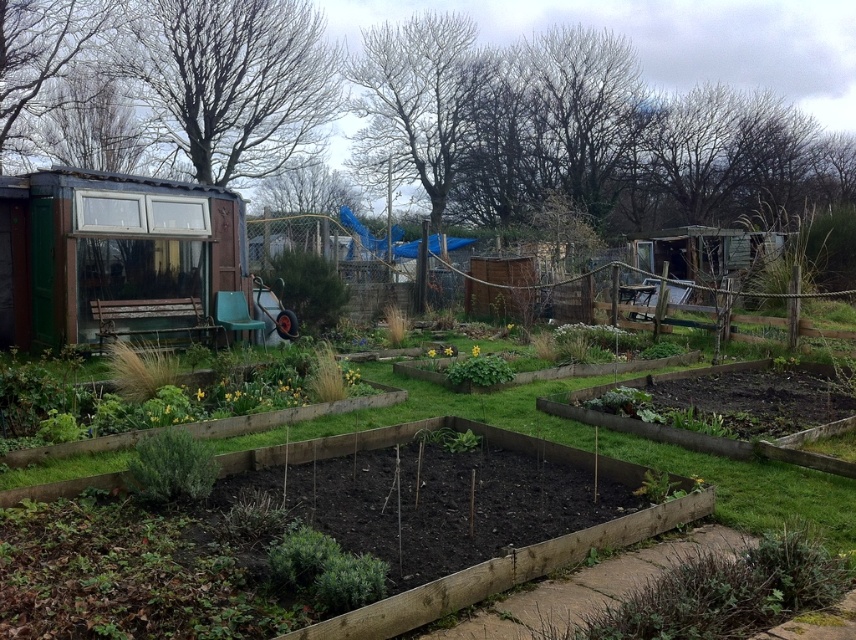
You are a gardener who needs to move a bag of soil from the brown wooden raised beds at center to the yellow matte flower bed at center. The bag weighs 50 pounds and you can carry it 5 feet without getting tired. Can you carry the bag all the way without needing to rest?

The brown wooden raised beds at center is 6.21 feet away from the yellow matte flower bed at center. Since the distance is greater than 5 feet, you will need to rest before completing the trip.

You are standing in the community garden and want to place a small statue between the two points labeled point [688,448] and point [512,371]. Since the statue requires a flat surface, which point is closer to you where you can safely place it?

Point [688,448] is closer to the viewer than point [512,371], so you can safely place the statue there as it is nearer and likely has a flat surface.